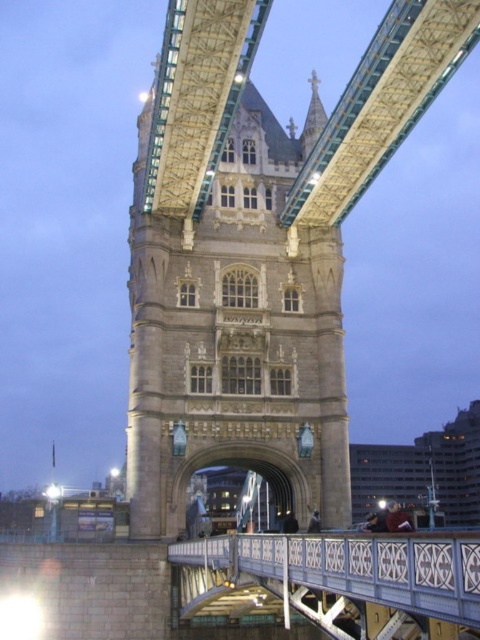
Question: Which object is farther from the camera taking this photo?

Choices:
 (A) stone tower at center
 (B) white painted metal bridge at center

Answer: (A)

Question: Is stone tower at center thinner than white painted metal bridge at center?

Choices:
 (A) yes
 (B) no

Answer: (A)

Question: Does stone tower at center appear on the left side of white painted metal bridge at center?

Choices:
 (A) no
 (B) yes

Answer: (B)

Question: Does stone tower at center appear under white painted metal bridge at center?

Choices:
 (A) yes
 (B) no

Answer: (B)

Question: Which point is farther to the camera?

Choices:
 (A) (139, 298)
 (B) (463, 577)

Answer: (A)